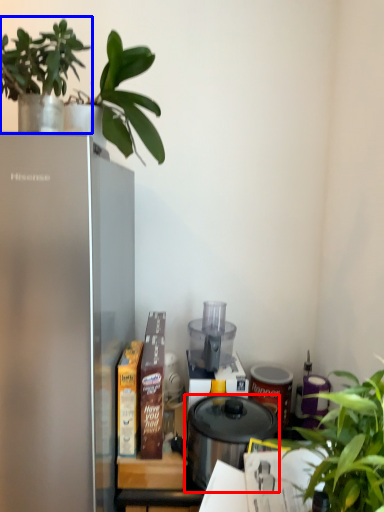
Question: Among these objects, which one is nearest to the camera, pressure cooker (highlighted by a red box) or houseplant (highlighted by a blue box)?

Choices:
 (A) pressure cooker
 (B) houseplant

Answer: (B)